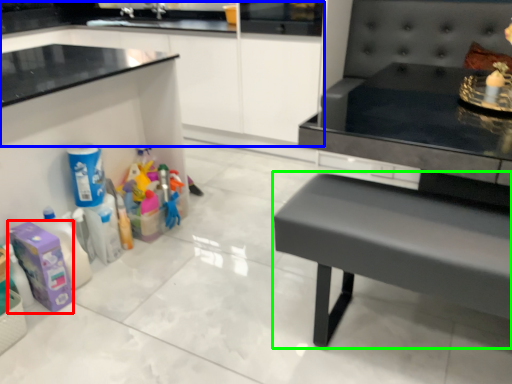
Question: Which object is positioned closest to cleaning product (highlighted by a red box)? Select from cabinetry (highlighted by a blue box) and table (highlighted by a green box).

Choices:
 (A) cabinetry
 (B) table

Answer: (B)